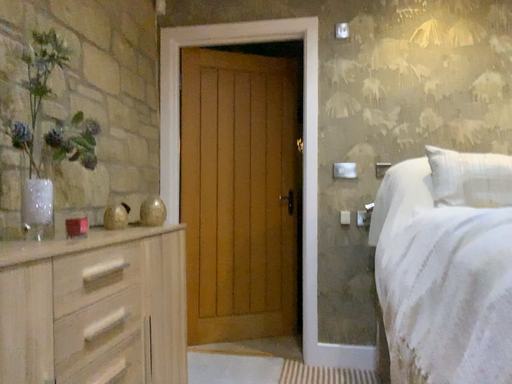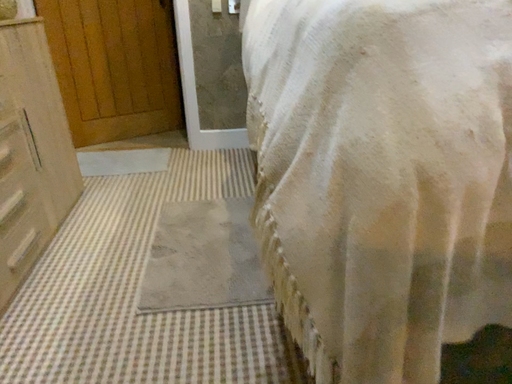
Question: How did the camera likely rotate when shooting the video?

Choices:
 (A) rotated right
 (B) rotated left

Answer: (A)